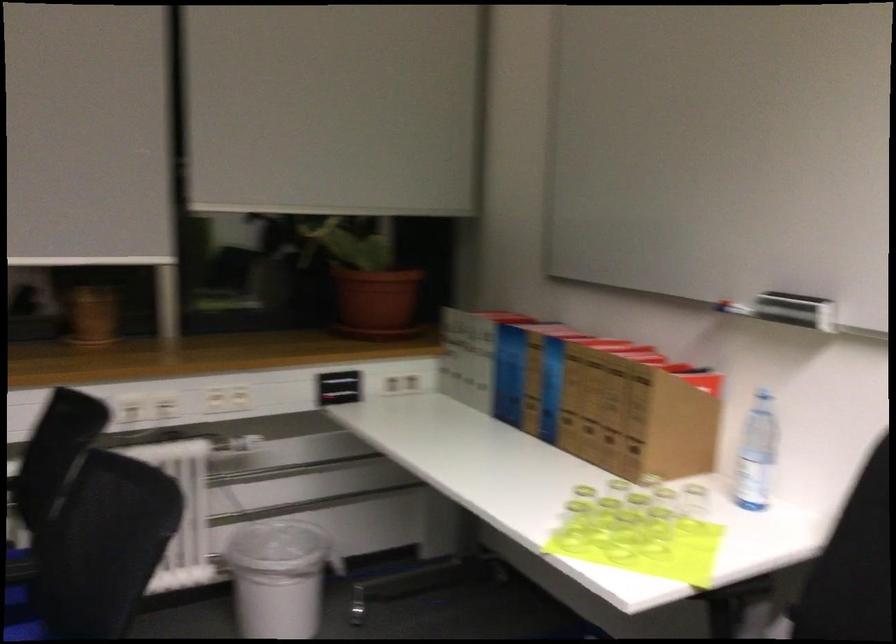
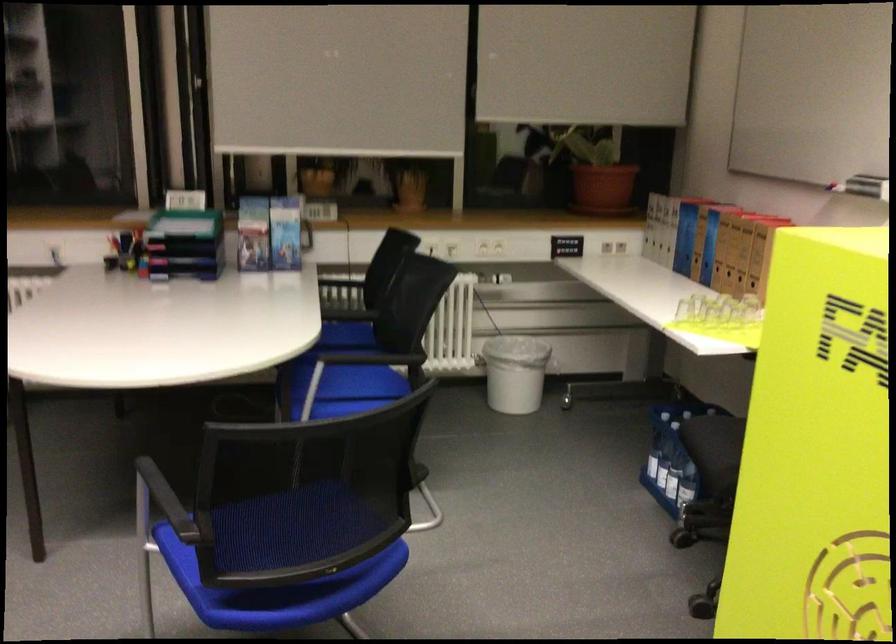
Where in the second image is the point corresponding to [380,306] from the first image?

(602, 187)